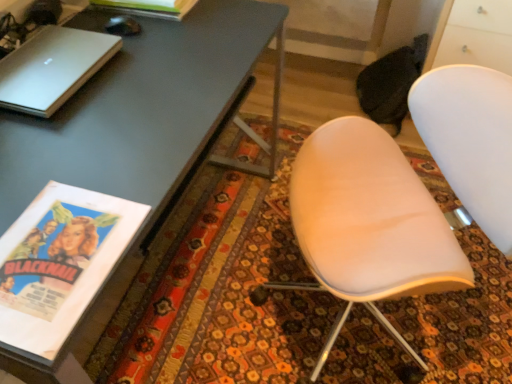
Question: Is there a large distance between white matte chair at center and black glossy mouse at upper left?

Choices:
 (A) yes
 (B) no

Answer: (B)

Question: Is black glossy mouse at upper left at the back of white matte chair at center?

Choices:
 (A) no
 (B) yes

Answer: (A)

Question: Does white matte chair at center have a greater width compared to black glossy mouse at upper left?

Choices:
 (A) yes
 (B) no

Answer: (A)

Question: From a real-world perspective, is white matte chair at center beneath black glossy mouse at upper left?

Choices:
 (A) yes
 (B) no

Answer: (A)

Question: Can you confirm if white matte chair at center is shorter than black glossy mouse at upper left?

Choices:
 (A) no
 (B) yes

Answer: (A)

Question: Is white matte chair at center bigger than black glossy mouse at upper left?

Choices:
 (A) yes
 (B) no

Answer: (A)

Question: Is matte paper magazine at upper left wider than white matte chair at center?

Choices:
 (A) yes
 (B) no

Answer: (B)

Question: Can you confirm if matte paper magazine at upper left is bigger than white matte chair at center?

Choices:
 (A) no
 (B) yes

Answer: (A)

Question: Can you confirm if matte paper magazine at upper left is positioned to the left of white matte chair at center?

Choices:
 (A) yes
 (B) no

Answer: (A)

Question: Is matte paper magazine at upper left surrounding white matte chair at center?

Choices:
 (A) yes
 (B) no

Answer: (B)

Question: From a real-world perspective, is matte paper magazine at upper left located higher than white matte chair at center?

Choices:
 (A) no
 (B) yes

Answer: (B)

Question: Does matte paper magazine at upper left have a smaller size compared to white matte chair at center?

Choices:
 (A) no
 (B) yes

Answer: (B)

Question: Is black glossy mouse at upper left in contact with white matte chair at center?

Choices:
 (A) no
 (B) yes

Answer: (A)